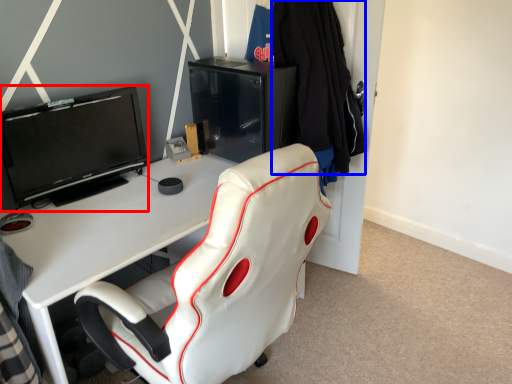
Question: Which of the following is the closest to the observer, television (highlighted by a red box) or clothing (highlighted by a blue box)?

Choices:
 (A) television
 (B) clothing

Answer: (A)